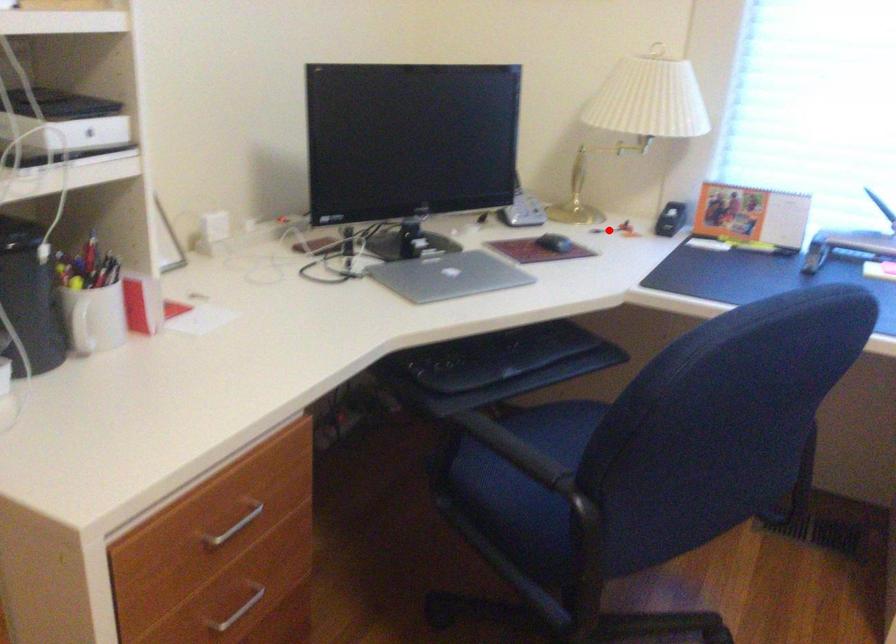
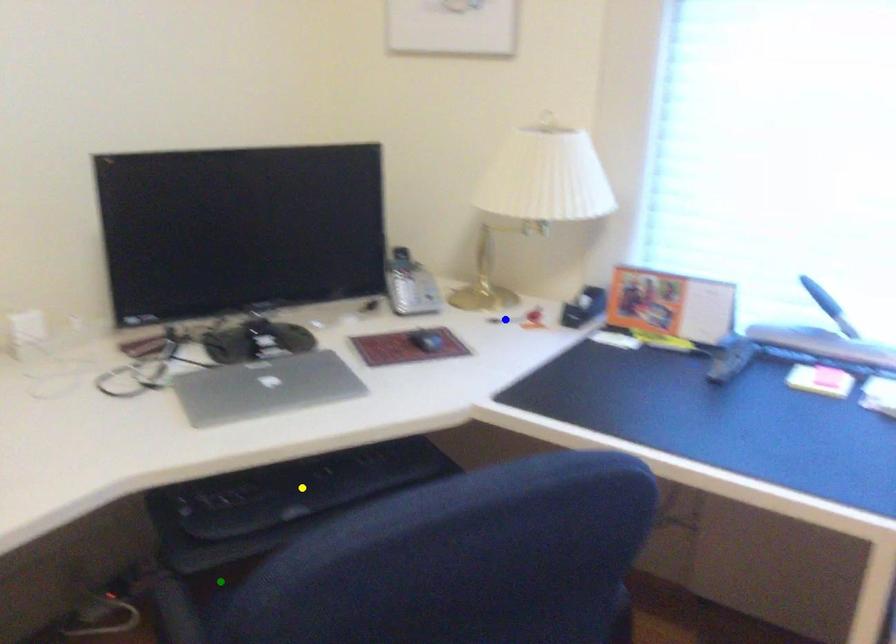
Question: I am providing you with two images of the same scene from different viewpoints. A red point is marked on the first image. You are given multiple points on the second image. In image 2, which mark is for the same physical point as the one in image 1?

Choices:
 (A) yellow point
 (B) green point
 (C) blue point

Answer: (C)